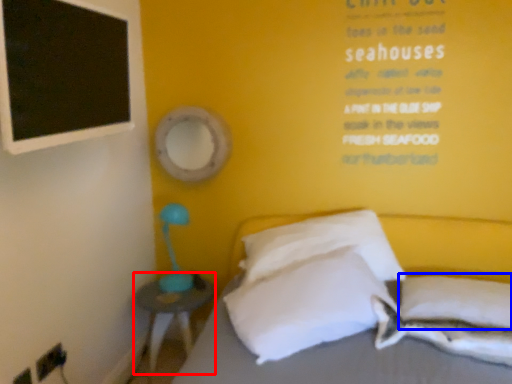
Question: Which of the following is the closest to the observer, nightstand (highlighted by a red box) or pillow (highlighted by a blue box)?

Choices:
 (A) nightstand
 (B) pillow

Answer: (B)